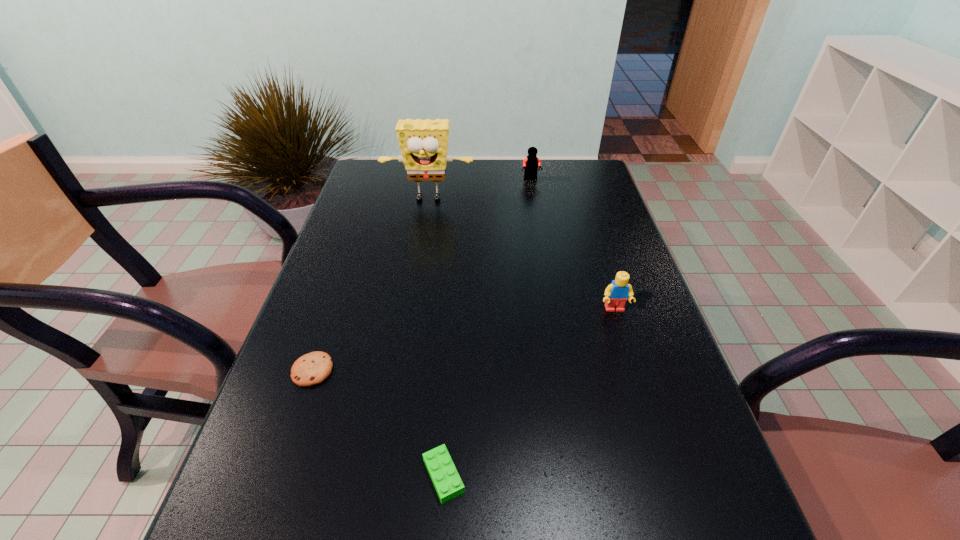
The image size is (960, 540). Identify the location of sponge. (423, 143).

You are a GUI agent. You are given a task and a screenshot of the screen. Output one action in this format:
    pyautogui.click(x=<x>, y=<y>)
    Task: Click on the tallest object
    
    Given the screenshot: What is the action you would take?
    pyautogui.click(x=423, y=143)

Find the location of a particular element. The image size is (960, 540). the farthest object is located at coordinates (532, 162).

I want to click on the farthest Lego, so click(x=532, y=162).

Find the location of a particular element. The image size is (960, 540). the second farthest Lego is located at coordinates click(x=616, y=294).

At what (x,y) coordinates should I click in order to perform the action: click on the rightmost Lego. Please return your answer as a coordinate pair (x, y). This screenshot has width=960, height=540. Looking at the image, I should click on (616, 294).

The image size is (960, 540). In order to click on the nearest object in this screenshot , I will do `click(447, 482)`.

This screenshot has width=960, height=540. I want to click on the fourth tallest object, so click(447, 482).

This screenshot has width=960, height=540. In order to click on the second nearest object in this screenshot , I will do `click(313, 368)`.

Locate an element on the screen. cookie is located at coordinates (313, 368).